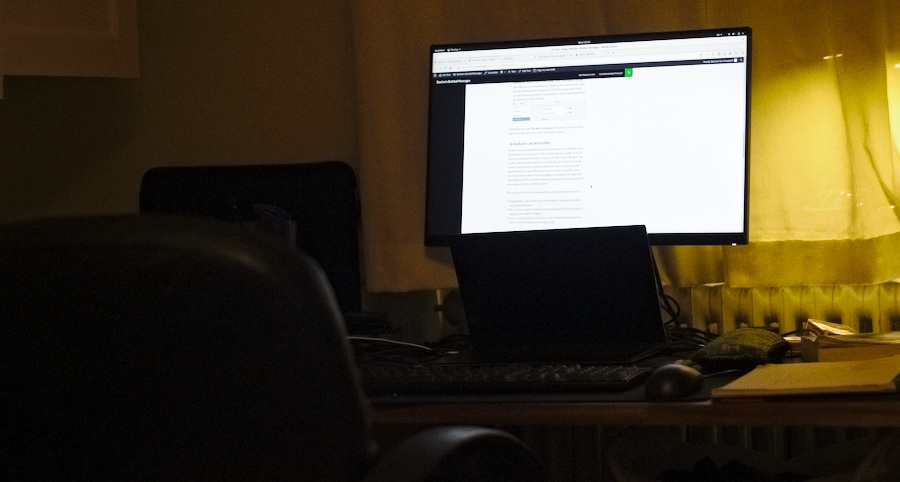
Where is `monitor`? The image size is (900, 482). monitor is located at coordinates (360, 247), (658, 300), (742, 222).